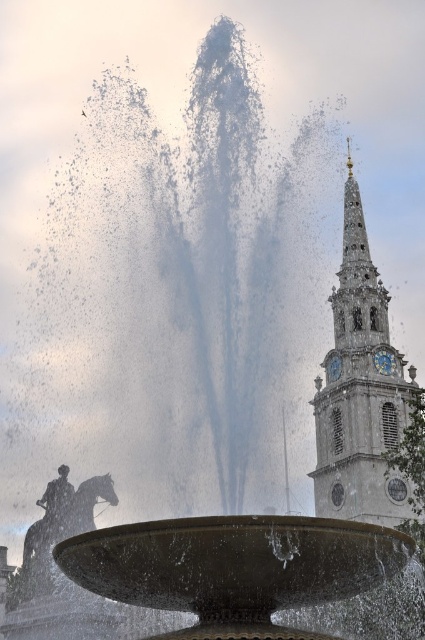
Does white stone clock tower at right have a lesser width compared to bronze statue at center?

In fact, white stone clock tower at right might be wider than bronze statue at center.

Is white stone clock tower at right bigger than bronze statue at center?

Yes.

Between point (348, 193) and point (28, 557), which one is positioned in front?

Positioned in front is point (28, 557).

You are a GUI agent. You are given a task and a screenshot of the screen. Output one action in this format:
    pyautogui.click(x=<x>, y=<y>)
    Task: Click on the white stone clock tower at right
    The height and width of the screenshot is (640, 425).
    Given the screenshot: What is the action you would take?
    pyautogui.click(x=359, y=388)